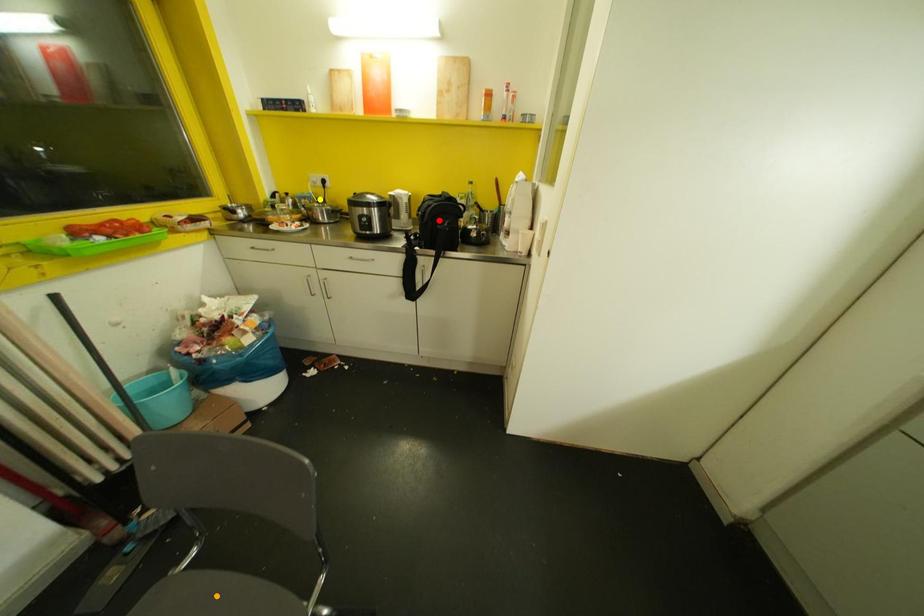
Order these from nearest to farthest:
red point | orange point | yellow point

orange point < red point < yellow point